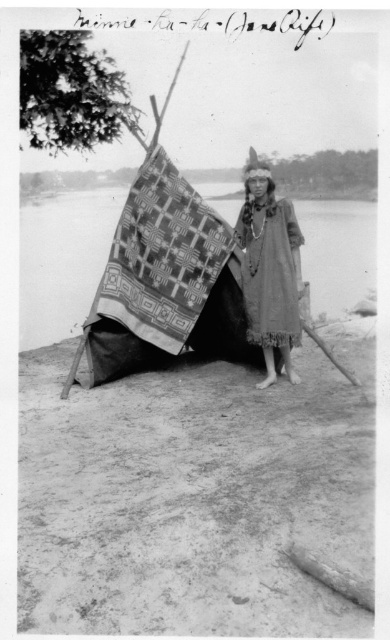
Question: Is patterned fabric blanket at center further to the viewer compared to textured woolen robe at center?

Choices:
 (A) no
 (B) yes

Answer: (B)

Question: Does patterned fabric blanket at center have a smaller size compared to textured woolen robe at center?

Choices:
 (A) yes
 (B) no

Answer: (B)

Question: Is patterned fabric blanket at center smaller than textured woolen robe at center?

Choices:
 (A) no
 (B) yes

Answer: (A)

Question: Which of the following is the closest to the observer?

Choices:
 (A) (127, 304)
 (B) (262, 241)

Answer: (B)

Question: Which point appears farthest from the camera in this image?

Choices:
 (A) (184, 244)
 (B) (255, 266)

Answer: (A)

Question: Which of the following is the farthest from the observer?

Choices:
 (A) patterned fabric blanket at center
 (B) textured woolen robe at center

Answer: (A)